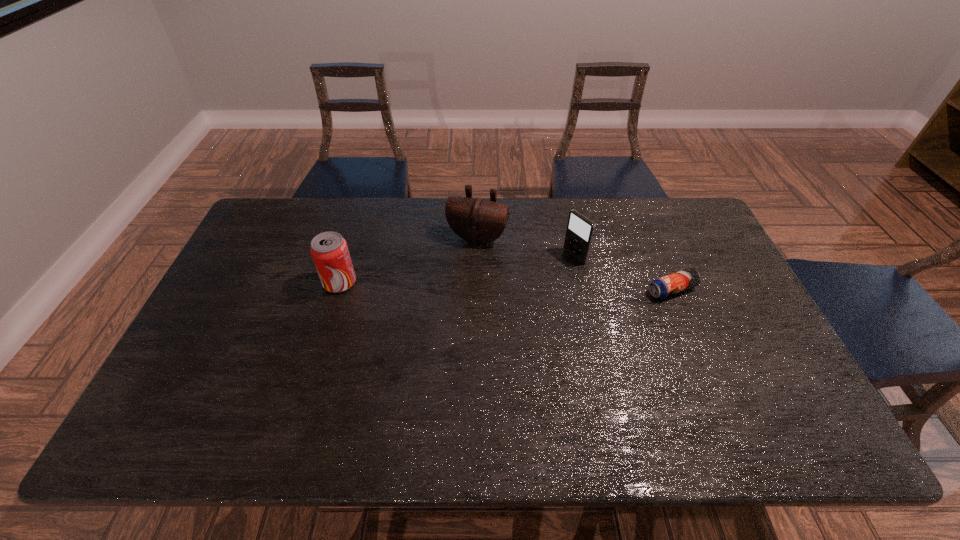
Where is `free space on the desktop that is between the leftmost object and the beer can and is positioned on the front-facing side of the iPod`? Image resolution: width=960 pixels, height=540 pixels. free space on the desktop that is between the leftmost object and the beer can and is positioned on the front-facing side of the iPod is located at coordinates coord(523,286).

Locate an element on the screen. vacant space on the desktop that is between the soda can and the shortest object and is positioned with the flap open on the pouch is located at coordinates pyautogui.click(x=457, y=285).